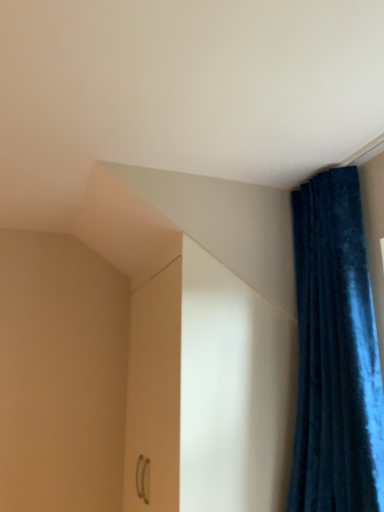
Question: Is velvet blue curtain at upper right wider or thinner than white glossy cabinet at center?

Choices:
 (A) wide
 (B) thin

Answer: (A)

Question: Looking at the image, does velvet blue curtain at upper right seem bigger or smaller compared to white glossy cabinet at center?

Choices:
 (A) small
 (B) big

Answer: (A)

Question: Would you say velvet blue curtain at upper right is to the left or to the right of white glossy cabinet at center in the picture?

Choices:
 (A) left
 (B) right

Answer: (B)

Question: Looking at their shapes, would you say white glossy cabinet at center is wider or thinner than velvet blue curtain at upper right?

Choices:
 (A) wide
 (B) thin

Answer: (B)

Question: From a real-world perspective, is white glossy cabinet at center physically located above or below velvet blue curtain at upper right?

Choices:
 (A) above
 (B) below

Answer: (B)

Question: Considering the positions of white glossy cabinet at center and velvet blue curtain at upper right in the image, is white glossy cabinet at center bigger or smaller than velvet blue curtain at upper right?

Choices:
 (A) big
 (B) small

Answer: (A)

Question: Considering the positions of white glossy cabinet at center and velvet blue curtain at upper right in the image, is white glossy cabinet at center taller or shorter than velvet blue curtain at upper right?

Choices:
 (A) short
 (B) tall

Answer: (A)